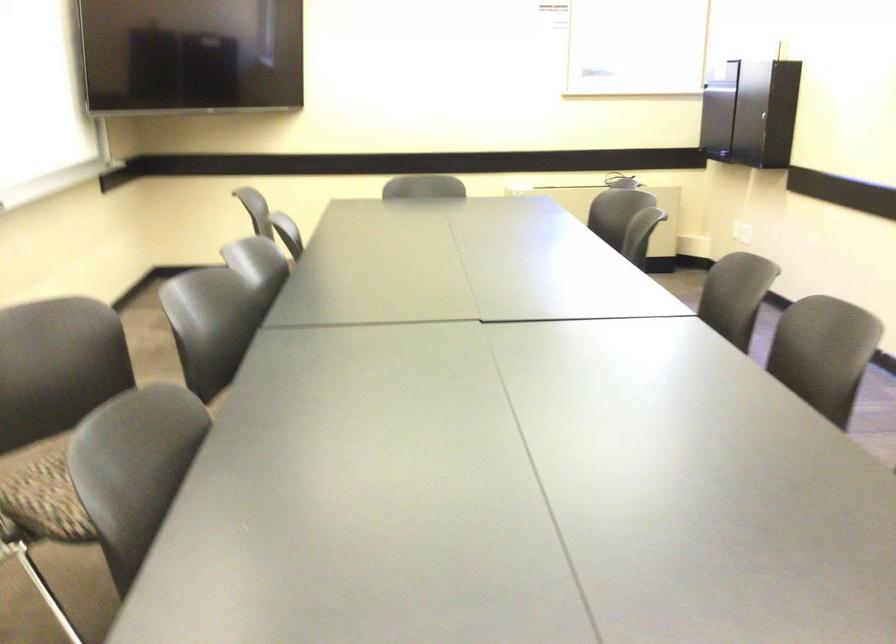
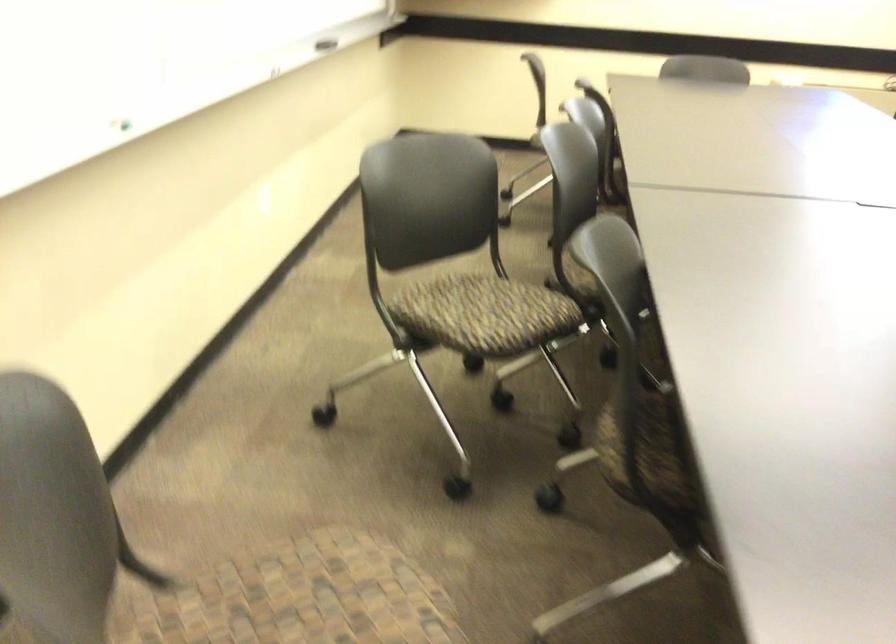
Question: How did the camera likely rotate?

Choices:
 (A) Left
 (B) Right
 (C) Up
 (D) Down

Answer: (A)